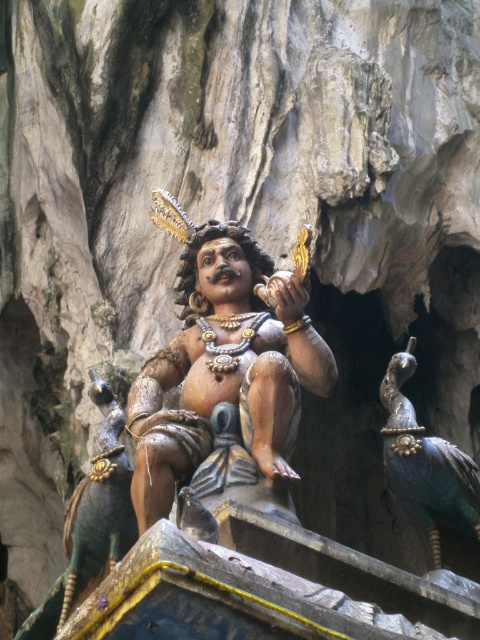
Between polished bronze statue at center and shiny teal peacock at right, which one is positioned higher?

polished bronze statue at center is higher up.

The image size is (480, 640). In order to click on polished bronze statue at center in this screenshot , I will do `click(225, 360)`.

Where is `polished bronze statue at center`? Image resolution: width=480 pixels, height=640 pixels. polished bronze statue at center is located at coordinates (225, 360).

In the scene shown: Does polished bronze statue at center have a greater width compared to shiny green peacock at center?

Yes.

Can you confirm if polished bronze statue at center is positioned above shiny green peacock at center?

Correct, polished bronze statue at center is located above shiny green peacock at center.

Is point (140, 499) behind point (75, 524)?

No, it is in front of (75, 524).

Locate an element on the screen. The width and height of the screenshot is (480, 640). polished bronze statue at center is located at coordinates (225, 360).

Who is taller, shiny teal peacock at right or shiny green peacock at center?

With more height is shiny green peacock at center.

At what (x,y) coordinates should I click in order to perform the action: click on shiny teal peacock at right. Please return your answer as a coordinate pair (x, y). The height and width of the screenshot is (640, 480). Looking at the image, I should click on (425, 465).

Is point (445, 468) positioned behind point (108, 474)?

Yes, it is.

You are a GUI agent. You are given a task and a screenshot of the screen. Output one action in this format:
    pyautogui.click(x=<x>, y=<y>)
    Task: Click on the shiny teal peacock at right
    This screenshot has height=640, width=480.
    Given the screenshot: What is the action you would take?
    pyautogui.click(x=425, y=465)